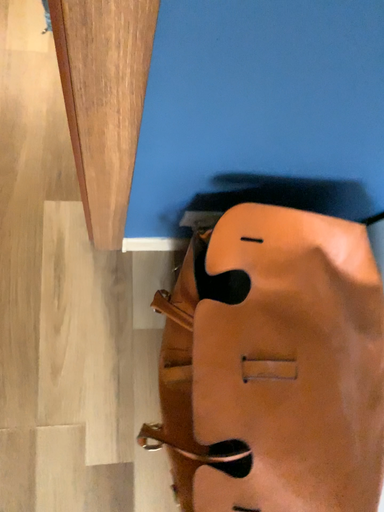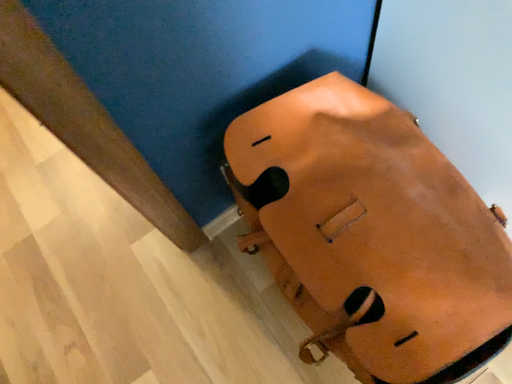
Question: How did the camera likely rotate when shooting the video?

Choices:
 (A) rotated upward
 (B) rotated downward

Answer: (A)